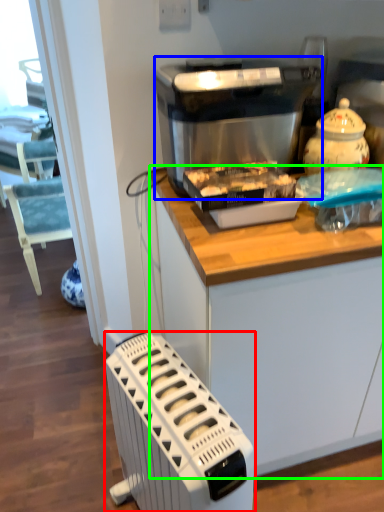
Question: Based on their relative distances, which object is nearer to home appliance (highlighted by a red box)? Choose from kitchen appliance (highlighted by a blue box) and cabinetry (highlighted by a green box).

Choices:
 (A) kitchen appliance
 (B) cabinetry

Answer: (B)